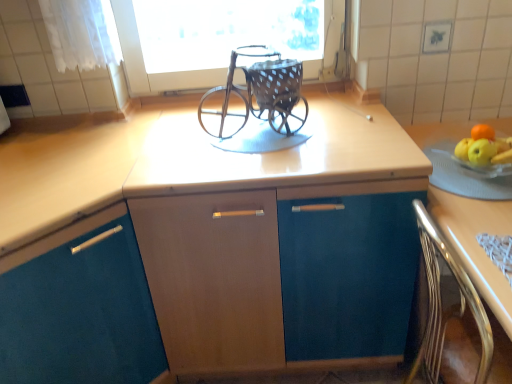
Find the location of a particular element. Image resolution: width=512 pixels, height=384 pixels. free space to the left of rustic metal baby carriage at center is located at coordinates (173, 147).